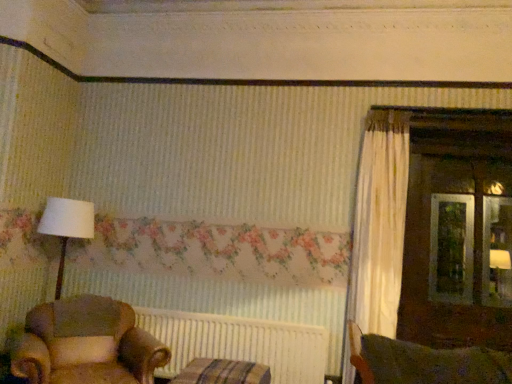
Question: Does leather armchair at lower left have a greater height compared to striped fabric cushion at lower center?

Choices:
 (A) yes
 (B) no

Answer: (A)

Question: Is leather armchair at lower left wider than striped fabric cushion at lower center?

Choices:
 (A) no
 (B) yes

Answer: (B)

Question: Considering the relative sizes of leather armchair at lower left and striped fabric cushion at lower center in the image provided, is leather armchair at lower left smaller than striped fabric cushion at lower center?

Choices:
 (A) yes
 (B) no

Answer: (B)

Question: From a real-world perspective, does leather armchair at lower left stand above striped fabric cushion at lower center?

Choices:
 (A) no
 (B) yes

Answer: (B)

Question: Considering the relative sizes of leather armchair at lower left and striped fabric cushion at lower center in the image provided, is leather armchair at lower left bigger than striped fabric cushion at lower center?

Choices:
 (A) yes
 (B) no

Answer: (A)

Question: From a real-world perspective, is leather armchair at lower left physically below striped fabric cushion at lower center?

Choices:
 (A) no
 (B) yes

Answer: (A)

Question: Is striped fabric cushion at lower center thinner than leather armchair at lower left?

Choices:
 (A) no
 (B) yes

Answer: (B)

Question: Is striped fabric cushion at lower center taller than leather armchair at lower left?

Choices:
 (A) yes
 (B) no

Answer: (B)

Question: Is striped fabric cushion at lower center outside leather armchair at lower left?

Choices:
 (A) yes
 (B) no

Answer: (A)

Question: From the image's perspective, is striped fabric cushion at lower center on top of leather armchair at lower left?

Choices:
 (A) no
 (B) yes

Answer: (A)

Question: Is striped fabric cushion at lower center smaller than leather armchair at lower left?

Choices:
 (A) no
 (B) yes

Answer: (B)

Question: Is the depth of striped fabric cushion at lower center greater than that of leather armchair at lower left?

Choices:
 (A) no
 (B) yes

Answer: (B)

Question: From the image's perspective, is leather armchair at lower left located beneath white ribbed radiator at center?

Choices:
 (A) no
 (B) yes

Answer: (A)